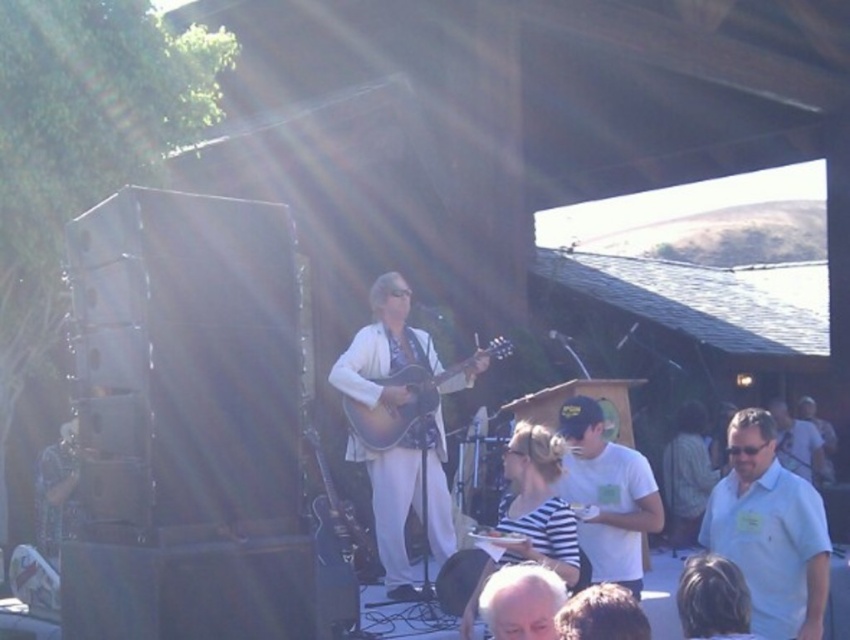
You are a photographer at the event and want to ensure both the white shirt at lower right and the white matte hair at lower center are clearly visible in your photo. Given their sizes, which object should you focus on first to ensure proper exposure?

The white shirt at lower right has a larger size compared to the white matte hair at lower center, so you should focus on the white shirt at lower right first to ensure proper exposure since it occupies more space in the frame.

You are a photographer at the event and want to take a photo of the white shirt at lower right and the matte brown guitar at center. Which object is located to the right of the other?

The white shirt at lower right is positioned on the right side of matte brown guitar at center, so the white shirt at lower right is to the right of the matte brown guitar at center.

You are a stagehand setting up a ladder to adjust the lighting above the stage. The ladder is 1.8 meters tall. You need to reach the light above the white shirt at lower right and the matte brown guitar at center. Which object will require the ladder to be fully extended to reach?

The matte brown guitar at center requires the ladder to be fully extended because the white shirt at lower right is not as tall as the matte brown guitar at center, so the guitar is taller and thus higher up, necessitating the full height of the ladder.